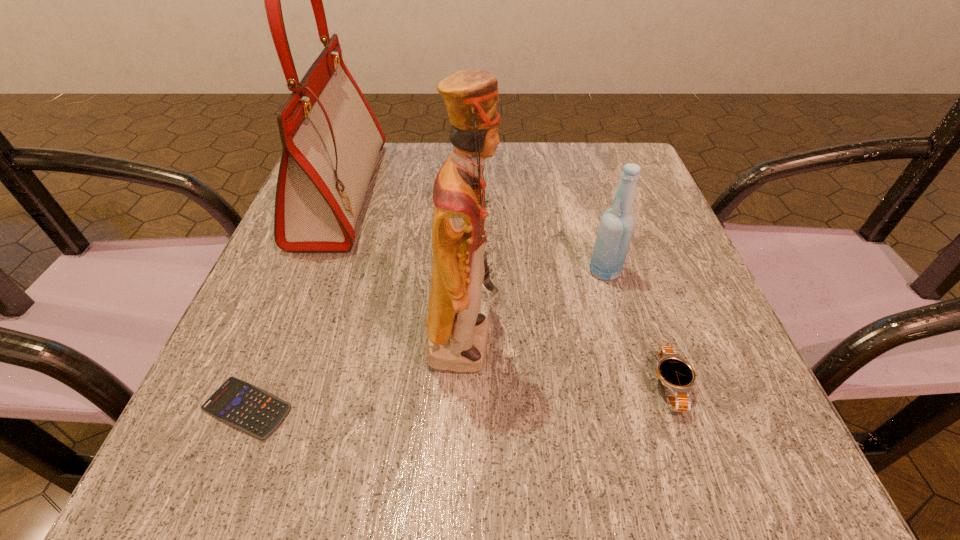
Image resolution: width=960 pixels, height=540 pixels. In order to click on handbag in this screenshot , I will do `click(331, 139)`.

You are a GUI agent. You are given a task and a screenshot of the screen. Output one action in this format:
    pyautogui.click(x=<x>, y=<y>)
    Task: Click on the nutcracker
    
    Given the screenshot: What is the action you would take?
    pyautogui.click(x=457, y=334)

The width and height of the screenshot is (960, 540). I want to click on bottle, so 617,224.

Locate an element on the screen. This screenshot has width=960, height=540. the fourth shortest object is located at coordinates tap(617, 224).

Identify the location of the fourth tallest object. The image size is (960, 540). click(485, 201).

Identify the location of the fifth tallest object. point(676,374).

You are a GUI agent. You are given a task and a screenshot of the screen. Output one action in this format:
    pyautogui.click(x=<x>, y=<y>)
    Task: Click on the calculator
    The height and width of the screenshot is (540, 960).
    Given the screenshot: What is the action you would take?
    pyautogui.click(x=248, y=408)

Where is `vacant space located on the right of the handbag`? vacant space located on the right of the handbag is located at coordinates (509, 193).

The image size is (960, 540). Identify the location of vacant space located on the front-facing side of the nutcracker. (579, 338).

You are a GUI agent. You are given a task and a screenshot of the screen. Output one action in this format:
    pyautogui.click(x=<x>, y=<y>)
    Task: Click on the free region located on the left of the fourth nearest object
    
    Given the screenshot: What is the action you would take?
    pyautogui.click(x=486, y=272)